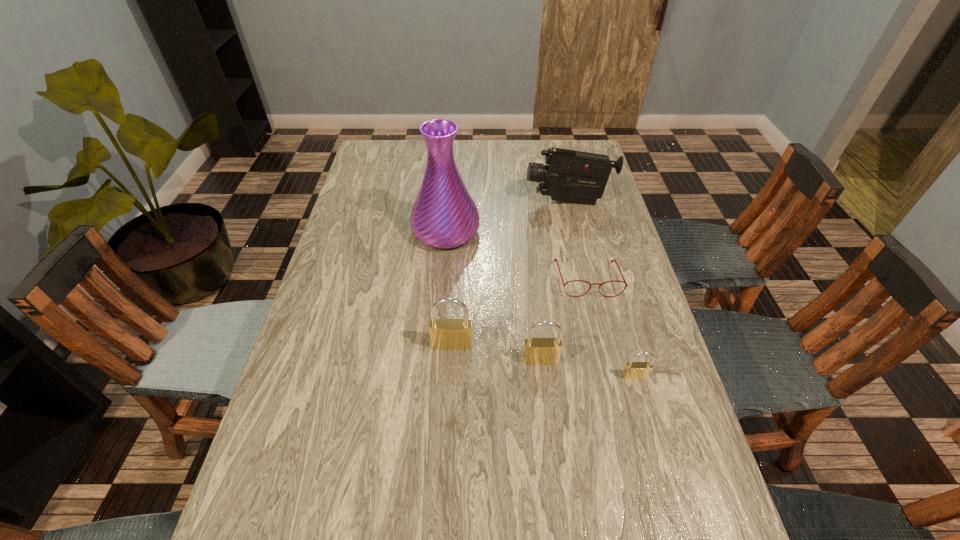
The image size is (960, 540). I want to click on empty space between the vase and the second shortest object, so click(540, 304).

At what (x,y) coordinates should I click in order to perform the action: click on vacant area between the fourth tallest object and the vase. Please return your answer as a coordinate pair (x, y). This screenshot has height=540, width=960. Looking at the image, I should click on (493, 296).

You are a GUI agent. You are given a task and a screenshot of the screen. Output one action in this format:
    pyautogui.click(x=<x>, y=<y>)
    Task: Click on the free area in between the second padlock from left to right and the camcorder
    The image size is (960, 540).
    Given the screenshot: What is the action you would take?
    pyautogui.click(x=554, y=281)

I want to click on free space between the farthest padlock and the fifth farthest object, so click(x=496, y=353).

Locate an element on the screen. unoccupied position between the shortest object and the second farthest object is located at coordinates (516, 255).

The height and width of the screenshot is (540, 960). I want to click on free point between the camcorder and the second padlock from left to right, so click(554, 281).

Find the location of a particular element. This screenshot has width=960, height=540. blank region between the farthest object and the spectacles is located at coordinates (578, 240).

This screenshot has width=960, height=540. Identify the location of blank region between the shortest padlock and the vase. (540, 304).

Point out which object is positioned as the nearest to the second shortest padlock. Please provide its 2D coordinates. Your answer should be formatted as a tuple, i.e. [(x, y)], where the tuple contains the x and y coordinates of a point satisfying the conditions above.

[(448, 333)]

The width and height of the screenshot is (960, 540). In order to click on object that stands as the second closest to the vase in this screenshot , I will do `click(555, 259)`.